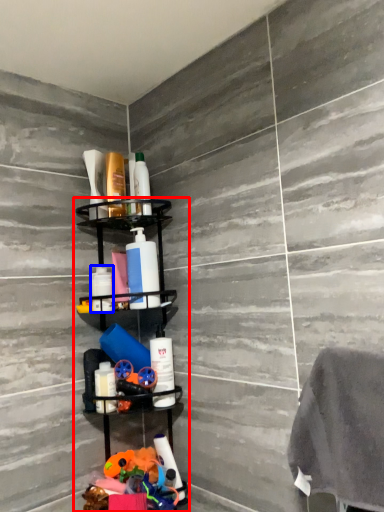
Question: Which of the following is the closest to the observer, shelf (highlighted by a red box) or toiletry (highlighted by a blue box)?

Choices:
 (A) shelf
 (B) toiletry

Answer: (A)